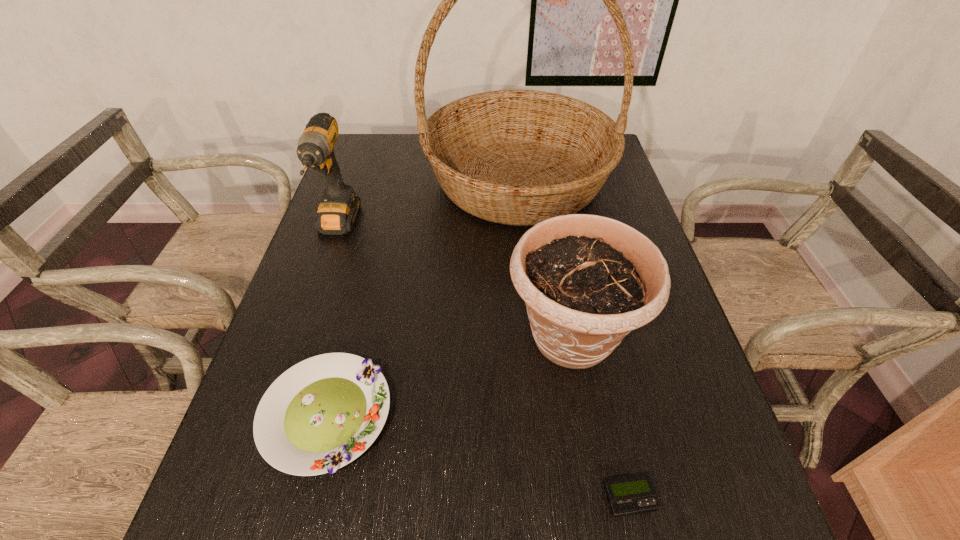
I want to click on object that is at the far edge, so click(x=517, y=157).

This screenshot has width=960, height=540. I want to click on drill located in the left edge section of the desktop, so click(338, 208).

The width and height of the screenshot is (960, 540). Identify the location of salad plate that is at the left edge. (321, 414).

This screenshot has height=540, width=960. Identify the location of basket that is at the right edge. point(517,157).

Image resolution: width=960 pixels, height=540 pixels. I want to click on flowerpot that is at the right edge, so click(587, 281).

The height and width of the screenshot is (540, 960). In order to click on beeper that is positioned at the right edge in this screenshot , I will do `click(631, 495)`.

Identify the location of object positioned at the far right corner. The height and width of the screenshot is (540, 960). (517, 157).

Where is `free point at the near edge`? free point at the near edge is located at coordinates (442, 524).

The height and width of the screenshot is (540, 960). Identify the location of vacant space at the left edge of the desktop. (347, 302).

At what (x,y) coordinates should I click in order to perform the action: click on blank space at the right edge of the desktop. Please return your answer as a coordinate pair (x, y). The width and height of the screenshot is (960, 540). Looking at the image, I should click on (683, 475).